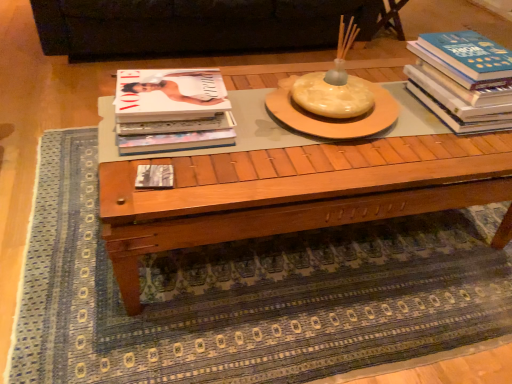
Where is `free area in between matte white magazine at left, which appears as the 2th book when viewed from the right, and matte black book at center, marked as the third book in a right-to-left arrangement`? free area in between matte white magazine at left, which appears as the 2th book when viewed from the right, and matte black book at center, marked as the third book in a right-to-left arrangement is located at coordinates (177, 167).